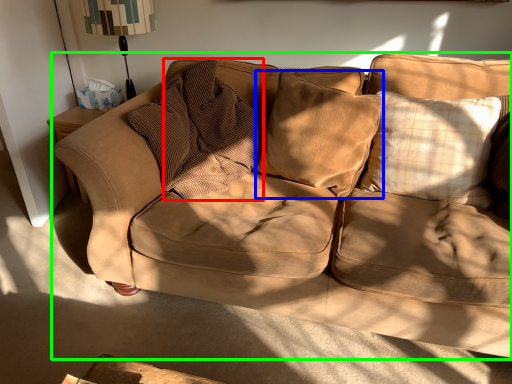
Question: Considering the real-world distances, which object is closest to pillow (highlighted by a red box)? pillow (highlighted by a blue box) or studio couch (highlighted by a green box).

Choices:
 (A) pillow
 (B) studio couch

Answer: (A)